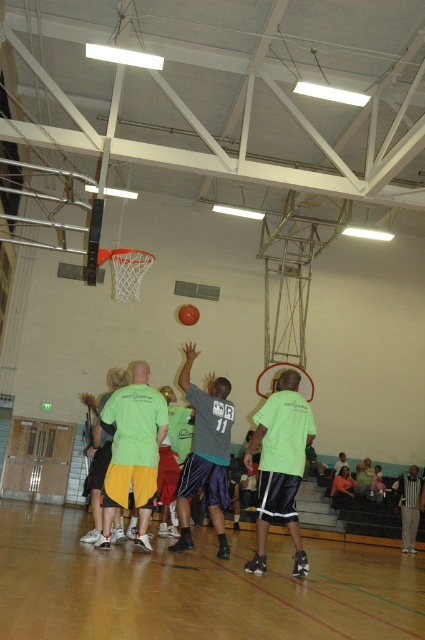
Can you confirm if wooden floor at lower center is taller than green fabric shirt at center?

Indeed, wooden floor at lower center has a greater height compared to green fabric shirt at center.

Which is more to the left, wooden floor at lower center or green fabric shirt at center?

green fabric shirt at center

Is point (8, 513) behind point (102, 417)?

Yes, it is behind point (102, 417).

The width and height of the screenshot is (425, 640). I want to click on wooden floor at lower center, so click(195, 588).

Is point (308, 566) farther from camera compared to point (161, 435)?

Yes, it is behind point (161, 435).

Which is more to the left, green matte shirt at center or green fabric shirt at center?

Positioned to the left is green fabric shirt at center.

Which is behind, point (297, 422) or point (112, 492)?

Point (297, 422)

Find the location of a particular element. This screenshot has width=425, height=640. green matte shirt at center is located at coordinates (280, 465).

Can you confirm if green matte shorts at center is shorter than gray fabric shorts at center?

Yes, green matte shorts at center is shorter than gray fabric shorts at center.

Is point (206, 468) in front of point (193, 465)?

That is False.

Who is more forward, (277, 515) or (201, 432)?

Point (277, 515)

Find the location of a particular element. The height and width of the screenshot is (640, 425). green matte shorts at center is located at coordinates (280, 465).